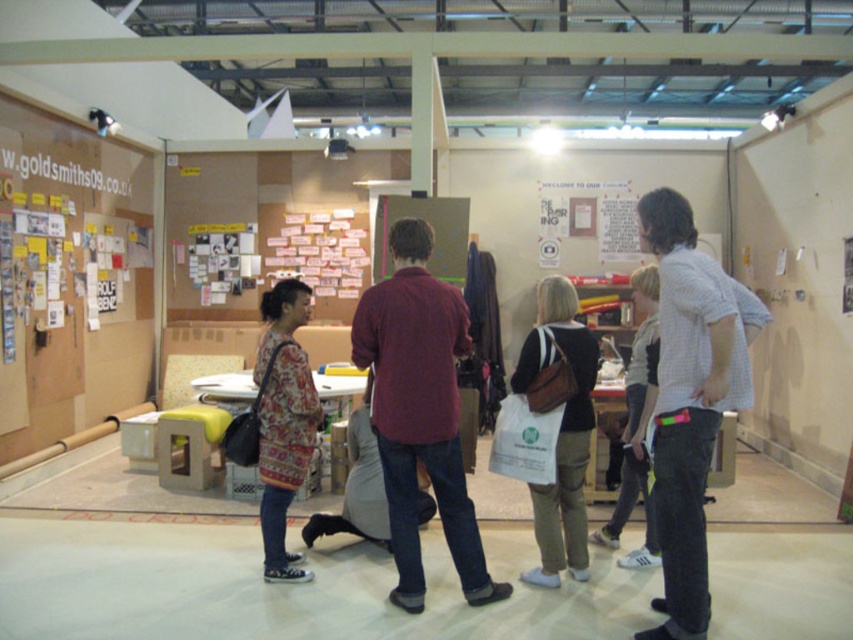
Which is more to the right, maroon shirt at center or white canvas tote bag at center?

Positioned to the right is white canvas tote bag at center.

Which is behind, point (421, 256) or point (550, 349)?

Positioned behind is point (550, 349).

Who is more forward, (447, 388) or (573, 540)?

Point (447, 388) is more forward.

Locate an element on the screen. The image size is (853, 640). maroon shirt at center is located at coordinates (419, 412).

Who is lower down, checkered cotton shirt at right or white canvas tote bag at center?

white canvas tote bag at center

Which of these two, checkered cotton shirt at right or white canvas tote bag at center, stands taller?

checkered cotton shirt at right is taller.

Which is in front, point (664, 584) or point (561, 365)?

Point (664, 584) is more forward.

Where is `checkered cotton shirt at right`? This screenshot has width=853, height=640. checkered cotton shirt at right is located at coordinates (689, 400).

Is checkered cotton shirt at right to the left of patterned fabric sweater at center from the viewer's perspective?

No, checkered cotton shirt at right is not to the left of patterned fabric sweater at center.

Can you confirm if checkered cotton shirt at right is positioned below patterned fabric sweater at center?

Actually, checkered cotton shirt at right is above patterned fabric sweater at center.

Image resolution: width=853 pixels, height=640 pixels. I want to click on checkered cotton shirt at right, so click(689, 400).